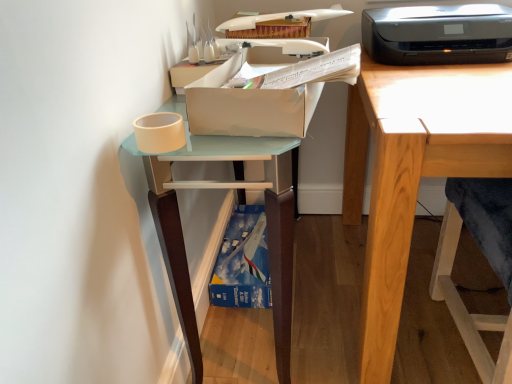
Question: Choose the correct answer: Is wooden folding chair at right inside wooden desk at right or outside it?

Choices:
 (A) inside
 (B) outside

Answer: (A)

Question: Is wooden folding chair at right bigger or smaller than wooden desk at right?

Choices:
 (A) big
 (B) small

Answer: (B)

Question: Which object is positioned closest to the matte white shelf at left?

Choices:
 (A) wooden folding chair at right
 (B) black plastic printer at upper right
 (C) wooden desk at right
 (D) cardboard box at upper center

Answer: (D)

Question: Considering the real-world distances, which object is closest to the matte white shelf at left?

Choices:
 (A) wooden folding chair at right
 (B) wooden desk at right
 (C) black plastic printer at upper right
 (D) cardboard box at upper center

Answer: (D)